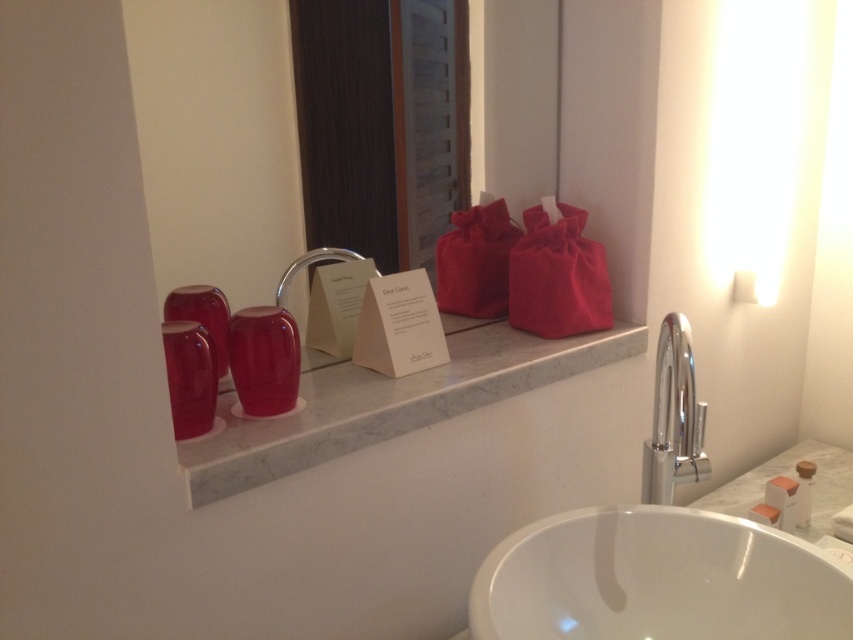
You are a guest staying in a hotel room and need to place your toothbrush on the bathroom counter. The white marble ledge at upper center and glossy plastic toiletries at center are both available. Which surface is suitable for placing the toothbrush?

The white marble ledge at upper center is positioned under the glossy plastic toiletries at center, so placing the toothbrush on the white marble ledge at upper center would be more stable and less likely to be disturbed by the toiletries above.

You are a guest in a hotel room and need to place a travel toothbrush on the bathroom counter. The travel toothbrush is 15 cm long. The white marble ledge at upper center and glossy plastic toiletries at center are both available. Which surface can accommodate the toothbrush without it hanging over the edge?

The white marble ledge at upper center has a greater width than the glossy plastic toiletries at center, so the travel toothbrush will fit better on the white marble ledge at upper center.